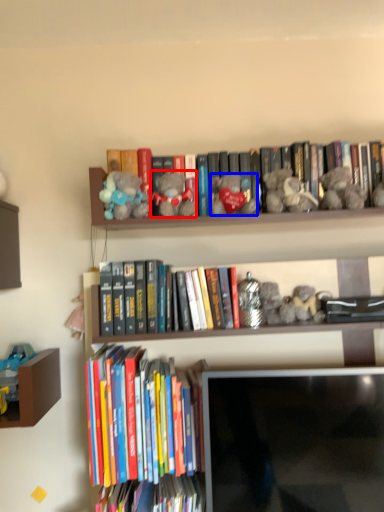
Question: Among these objects, which one is nearest to the camera, toy (highlighted by a red box) or toy (highlighted by a blue box)?

Choices:
 (A) toy
 (B) toy

Answer: (A)